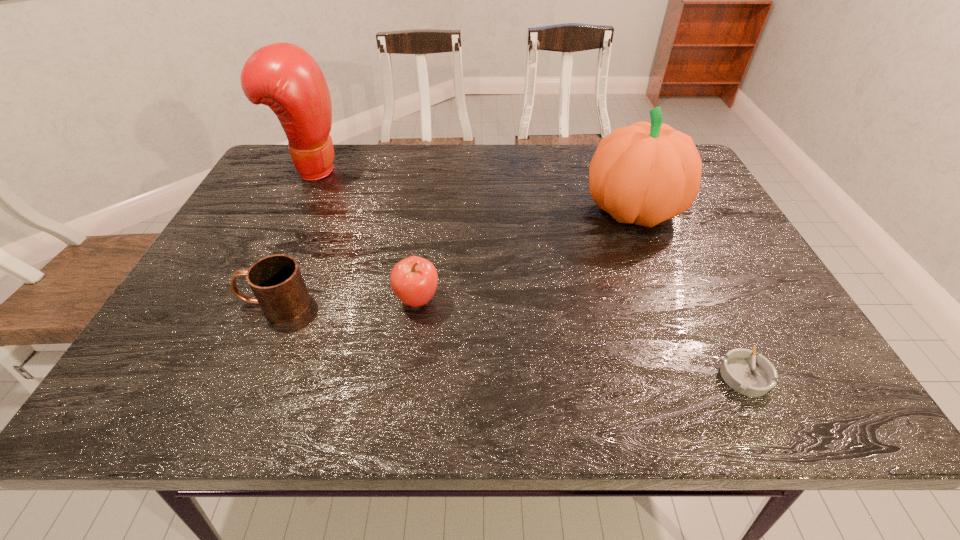
Where is `object present at the near right corner`? object present at the near right corner is located at coordinates (754, 376).

In the image, there is a desktop. Identify the location of free space at the far edge. (564, 171).

At what (x,y) coordinates should I click in order to perform the action: click on free region at the near edge of the desktop. Please return your answer as a coordinate pair (x, y). Looking at the image, I should click on (285, 396).

In the image, there is a desktop. Identify the location of vacant space at the left edge. (208, 260).

In the image, there is a desktop. Identify the location of vacant space at the right edge. (770, 290).

Locate an element on the screen. The width and height of the screenshot is (960, 540). free space between the boxing glove and the pumpkin is located at coordinates (472, 190).

This screenshot has width=960, height=540. In order to click on free point between the pumpkin and the boxing glove in this screenshot , I will do `click(472, 190)`.

This screenshot has width=960, height=540. What are the coordinates of `vacant space that is in between the shortest object and the third object from right to left` in the screenshot? It's located at [581, 338].

Locate an element on the screen. Image resolution: width=960 pixels, height=540 pixels. vacant point located between the second tallest object and the third shortest object is located at coordinates (525, 255).

You are a GUI agent. You are given a task and a screenshot of the screen. Output one action in this format:
    pyautogui.click(x=<x>, y=<y>)
    Task: Click on the free space between the pumpkin and the tallest object
    
    Given the screenshot: What is the action you would take?
    pyautogui.click(x=472, y=190)